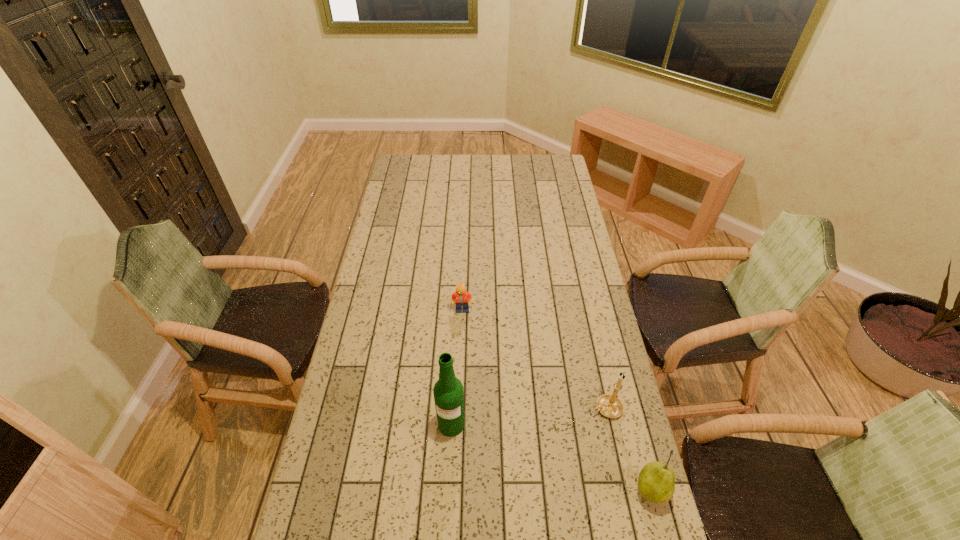
You are a GUI agent. You are given a task and a screenshot of the screen. Output one action in this format:
    pyautogui.click(x=<x>, y=<y>)
    Task: Click on the third closest object relative to the second tallest object
    
    Given the screenshot: What is the action you would take?
    (x=460, y=297)

Find the location of a particular element. object that is the closest to the beer bottle is located at coordinates (609, 405).

You are a GUI agent. You are given a task and a screenshot of the screen. Output one action in this format:
    pyautogui.click(x=<x>, y=<y>)
    Task: Click on the vacant space that satisfies the following two spatial constraints: 1. on the label of the pear; 2. on the left side of the beer bottle
    This screenshot has width=960, height=540.
    Given the screenshot: What is the action you would take?
    pyautogui.click(x=448, y=490)